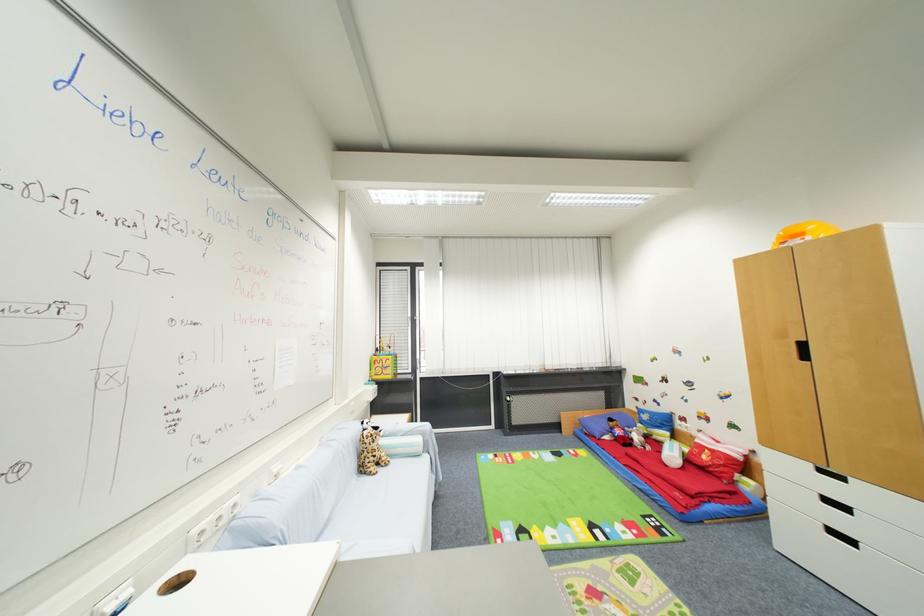
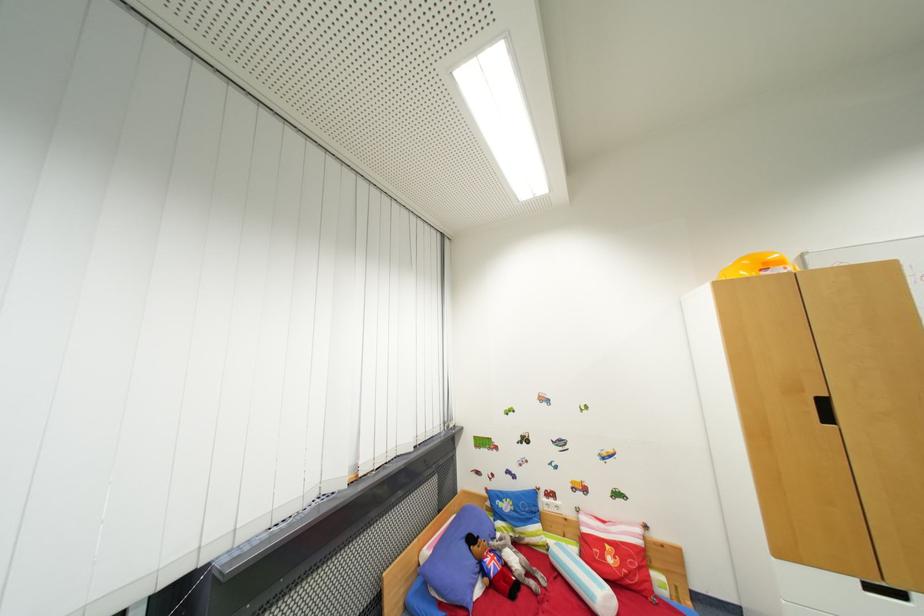
Where in the second image is the point corresponding to (615,422) from the first image?

(477, 541)